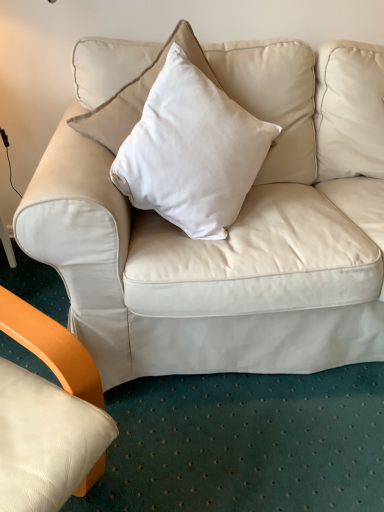
Question: Is white soft cushion at center wider or thinner than matte white couch at center?

Choices:
 (A) wide
 (B) thin

Answer: (A)

Question: Based on their positions, is white soft cushion at center located to the left or right of matte white couch at center?

Choices:
 (A) left
 (B) right

Answer: (B)

Question: Relative to matte white couch at center, is white soft cushion at center in front or behind?

Choices:
 (A) front
 (B) behind

Answer: (A)

Question: Is matte white couch at center taller or shorter than white soft cushion at center?

Choices:
 (A) tall
 (B) short

Answer: (A)

Question: Based on their positions, is matte white couch at center located to the left or right of white soft cushion at center?

Choices:
 (A) right
 (B) left

Answer: (B)

Question: Based on their sizes in the image, would you say matte white couch at center is bigger or smaller than white soft cushion at center?

Choices:
 (A) small
 (B) big

Answer: (B)

Question: From the image's perspective, relative to white soft cushion at center, is matte white couch at center above or below?

Choices:
 (A) above
 (B) below

Answer: (A)